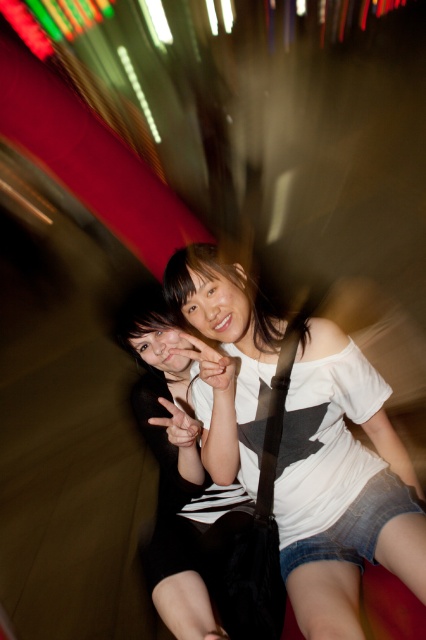
Question: Is white matte shirt at center positioned at the back of black matte dress at center?

Choices:
 (A) no
 (B) yes

Answer: (A)

Question: Can you confirm if white matte shirt at center is positioned to the right of black matte dress at center?

Choices:
 (A) yes
 (B) no

Answer: (A)

Question: Considering the relative positions of white matte shirt at center and black matte dress at center in the image provided, where is white matte shirt at center located with respect to black matte dress at center?

Choices:
 (A) below
 (B) above

Answer: (B)